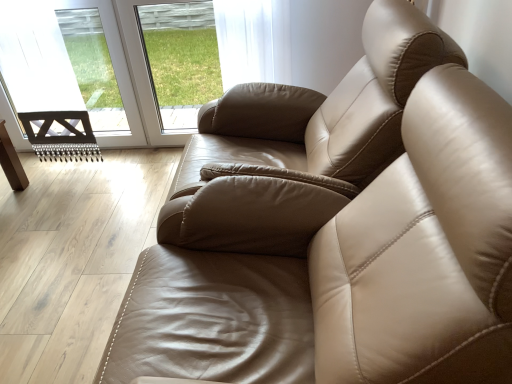
Question: Considering the relative sizes of transparent glass window at upper center and satin beige armchair at center in the image provided, is transparent glass window at upper center bigger than satin beige armchair at center?

Choices:
 (A) no
 (B) yes

Answer: (A)

Question: Is transparent glass window at upper center positioned in front of satin beige armchair at center?

Choices:
 (A) no
 (B) yes

Answer: (A)

Question: Is transparent glass window at upper center outside of satin beige armchair at center?

Choices:
 (A) no
 (B) yes

Answer: (B)

Question: From the image's perspective, is transparent glass window at upper center above satin beige armchair at center?

Choices:
 (A) yes
 (B) no

Answer: (A)

Question: Can you confirm if transparent glass window at upper center is wider than satin beige armchair at center?

Choices:
 (A) yes
 (B) no

Answer: (B)

Question: Is transparent glass door at upper left wider or thinner than transparent glass window at upper center?

Choices:
 (A) wide
 (B) thin

Answer: (A)

Question: Is transparent glass door at upper left inside or outside of transparent glass window at upper center?

Choices:
 (A) outside
 (B) inside

Answer: (A)

Question: In the image, is transparent glass door at upper left on the left side or the right side of transparent glass window at upper center?

Choices:
 (A) left
 (B) right

Answer: (A)

Question: Is point (112, 49) closer or farther from the camera than point (174, 66)?

Choices:
 (A) closer
 (B) farther

Answer: (A)

Question: Do you think transparent glass door at upper left is within satin beige armchair at center, or outside of it?

Choices:
 (A) inside
 (B) outside

Answer: (B)

Question: Is transparent glass door at upper left bigger or smaller than satin beige armchair at center?

Choices:
 (A) big
 (B) small

Answer: (B)

Question: In terms of width, does transparent glass door at upper left look wider or thinner when compared to satin beige armchair at center?

Choices:
 (A) wide
 (B) thin

Answer: (B)

Question: Is point (22, 145) closer or farther from the camera than point (253, 198)?

Choices:
 (A) farther
 (B) closer

Answer: (A)

Question: Is point pyautogui.click(x=368, y=158) positioned closer to the camera than point pyautogui.click(x=132, y=3)?

Choices:
 (A) farther
 (B) closer

Answer: (B)

Question: Is satin beige armchair at center taller or shorter than transparent glass door at upper left?

Choices:
 (A) tall
 (B) short

Answer: (A)